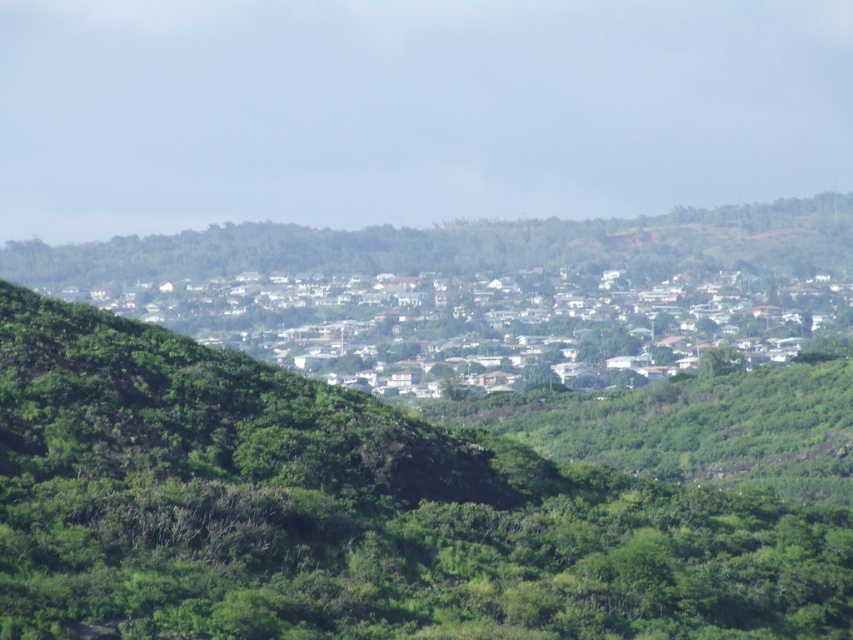
Is green leafy tree at center below white matte houses at center?

Correct, green leafy tree at center is located below white matte houses at center.

Does green leafy tree at center have a smaller size compared to white matte houses at center?

Correct, green leafy tree at center occupies less space than white matte houses at center.

What do you see at coordinates (349, 513) in the screenshot? I see `green leafy tree at center` at bounding box center [349, 513].

Where is `green leafy tree at center`? The image size is (853, 640). green leafy tree at center is located at coordinates (349, 513).